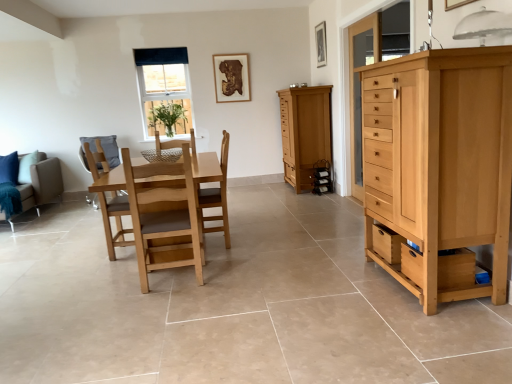
Question: Is wooden picture frame at upper center, placed as the second picture frame when sorted from left to right, placed right next to light brown wooden chair at center, the first chair positioned from the left?

Choices:
 (A) yes
 (B) no

Answer: (B)

Question: Is wooden picture frame at upper center, placed as the 1th picture frame when sorted from front to back, taller than light brown wooden chair at center, which appears as the 2th chair when viewed from the right?

Choices:
 (A) yes
 (B) no

Answer: (B)

Question: Is the position of wooden picture frame at upper center, placed as the second picture frame when sorted from left to right, less distant than that of light brown wooden chair at center, the first chair positioned from the left?

Choices:
 (A) yes
 (B) no

Answer: (B)

Question: From a real-world perspective, is wooden picture frame at upper center, placed as the second picture frame when sorted from left to right, located beneath light brown wooden chair at center, the first chair positioned from the left?

Choices:
 (A) yes
 (B) no

Answer: (B)

Question: Is the position of wooden picture frame at upper center, placed as the 1th picture frame when sorted from front to back, more distant than that of light brown wooden chair at center, the first chair positioned from the left?

Choices:
 (A) no
 (B) yes

Answer: (B)

Question: Would you say wooden drawer at lower right is inside or outside light brown wooden swivel chair at center-left?

Choices:
 (A) inside
 (B) outside

Answer: (B)

Question: Is point (386, 259) positioned closer to the camera than point (82, 150)?

Choices:
 (A) closer
 (B) farther

Answer: (A)

Question: Is wooden drawer at lower right taller or shorter than light brown wooden swivel chair at center-left?

Choices:
 (A) tall
 (B) short

Answer: (B)

Question: In the image, is wooden drawer at lower right positioned in front of or behind light brown wooden swivel chair at center-left?

Choices:
 (A) behind
 (B) front

Answer: (B)

Question: From the image's perspective, relative to clear glass window at upper center, is wooden drawer at lower right above or below?

Choices:
 (A) below
 (B) above

Answer: (A)

Question: Considering the positions of wooden drawer at lower right and clear glass window at upper center in the image, is wooden drawer at lower right taller or shorter than clear glass window at upper center?

Choices:
 (A) tall
 (B) short

Answer: (B)

Question: Considering the positions of wooden drawer at lower right and clear glass window at upper center in the image, is wooden drawer at lower right bigger or smaller than clear glass window at upper center?

Choices:
 (A) big
 (B) small

Answer: (B)

Question: In terms of width, does wooden drawer at lower right look wider or thinner when compared to clear glass window at upper center?

Choices:
 (A) wide
 (B) thin

Answer: (A)

Question: From a real-world perspective, is light brown wood chair at center, the 1th chair positioned from the right, positioned above or below wooden drawer at lower right?

Choices:
 (A) above
 (B) below

Answer: (A)

Question: In terms of height, does light brown wood chair at center, which ranks as the second chair in left-to-right order, look taller or shorter compared to wooden drawer at lower right?

Choices:
 (A) short
 (B) tall

Answer: (B)